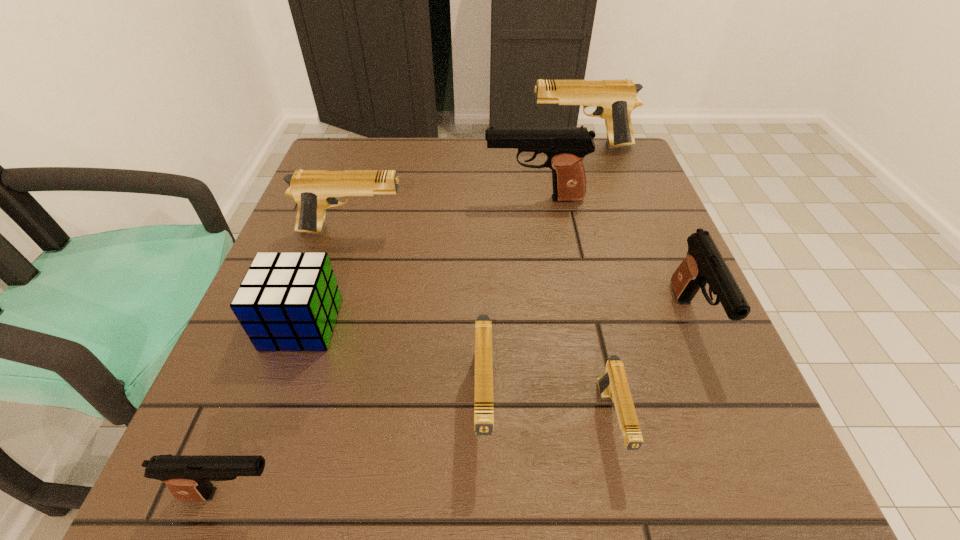
Identify the location of the leftmost black pistol. (188, 478).

Where is `the nearest black pistol`? The image size is (960, 540). the nearest black pistol is located at coordinates (188, 478).

Find the location of a particular element. the shortest object is located at coordinates (613, 385).

Image resolution: width=960 pixels, height=540 pixels. I want to click on the smallest tan pistol, so pos(613,385).

The image size is (960, 540). I want to click on free region located 0.400m at the barrel of the biggest black pistol, so click(x=308, y=199).

Find the location of a particular element. vacant region located at the barrel of the biggest black pistol is located at coordinates (374, 199).

Where is `free space located at the barrel of the biggest black pistol`? The height and width of the screenshot is (540, 960). free space located at the barrel of the biggest black pistol is located at coordinates (449, 199).

Where is `vacant space situated at the barrel of the farthest pistol`? The width and height of the screenshot is (960, 540). vacant space situated at the barrel of the farthest pistol is located at coordinates (409, 145).

The width and height of the screenshot is (960, 540). I want to click on vacant space located at the barrel of the farthest pistol, so click(424, 145).

I want to click on vacant space located 0.290m at the barrel of the farthest pistol, so click(x=420, y=145).